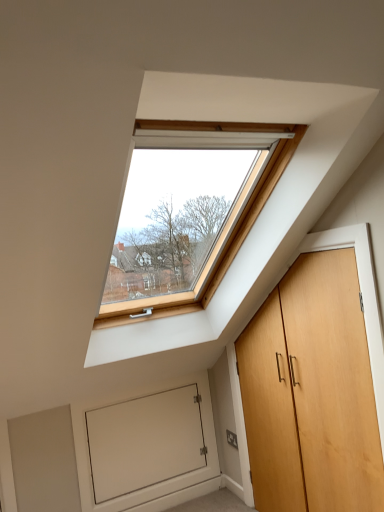
Question: Is white matte door at lower left shorter than light brown wood door at right?

Choices:
 (A) yes
 (B) no

Answer: (A)

Question: Is white matte door at lower left taller than light brown wood door at right?

Choices:
 (A) no
 (B) yes

Answer: (A)

Question: Could you tell me if white matte door at lower left is turned towards light brown wood door at right?

Choices:
 (A) yes
 (B) no

Answer: (A)

Question: Is white matte door at lower left outside light brown wood door at right?

Choices:
 (A) yes
 (B) no

Answer: (A)

Question: From a real-world perspective, is white matte door at lower left located higher than light brown wood door at right?

Choices:
 (A) no
 (B) yes

Answer: (A)

Question: Considering the relative positions of white matte door at lower left and light brown wood door at right in the image provided, is white matte door at lower left to the left of light brown wood door at right from the viewer's perspective?

Choices:
 (A) yes
 (B) no

Answer: (A)

Question: Is light brown wood door at right wider than white matte door at lower left?

Choices:
 (A) no
 (B) yes

Answer: (B)

Question: Does light brown wood door at right come behind white matte door at lower left?

Choices:
 (A) yes
 (B) no

Answer: (B)

Question: Is light brown wood door at right next to white matte door at lower left?

Choices:
 (A) yes
 (B) no

Answer: (B)

Question: Does light brown wood door at right have a smaller size compared to white matte door at lower left?

Choices:
 (A) yes
 (B) no

Answer: (B)

Question: Is light brown wood door at right oriented away from white matte door at lower left?

Choices:
 (A) no
 (B) yes

Answer: (A)

Question: Is light brown wood door at right positioned in front of white matte door at lower left?

Choices:
 (A) yes
 (B) no

Answer: (A)

Question: Is white matte door at lower left bigger or smaller than light brown wood door at right?

Choices:
 (A) small
 (B) big

Answer: (A)